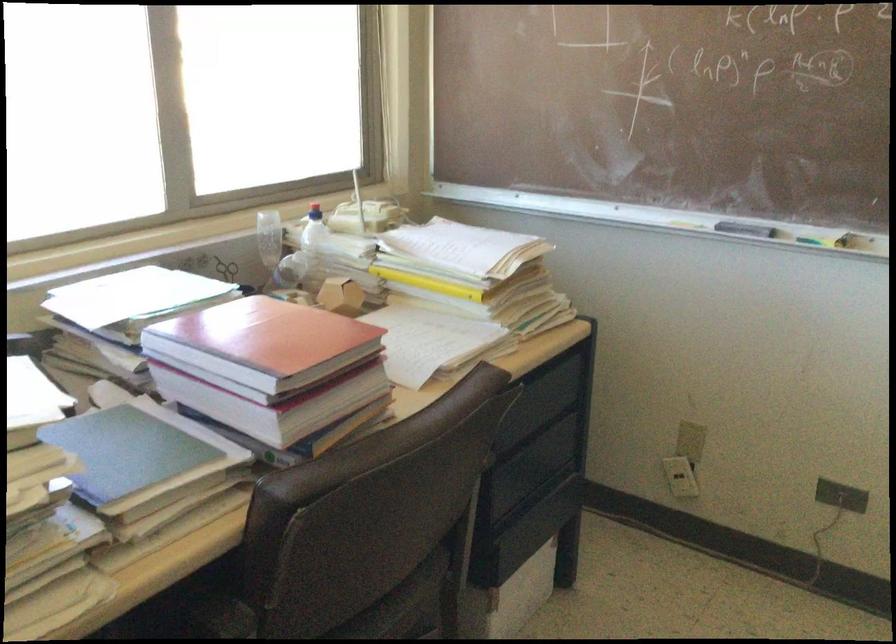
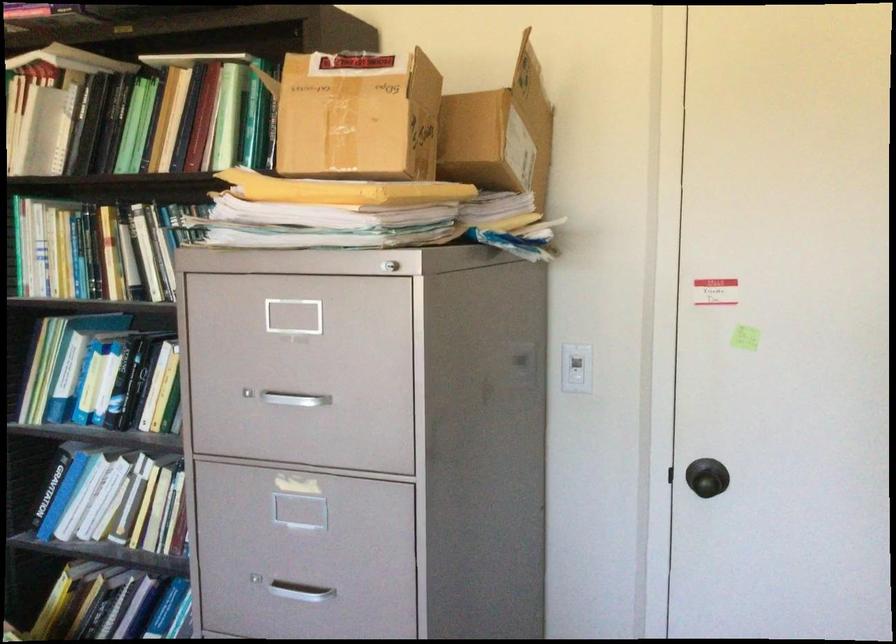
Question: The images are taken continuously from a first-person perspective. In which direction is your viewpoint rotating?

Choices:
 (A) Left
 (B) Right
 (C) Up
 (D) Down

Answer: (B)